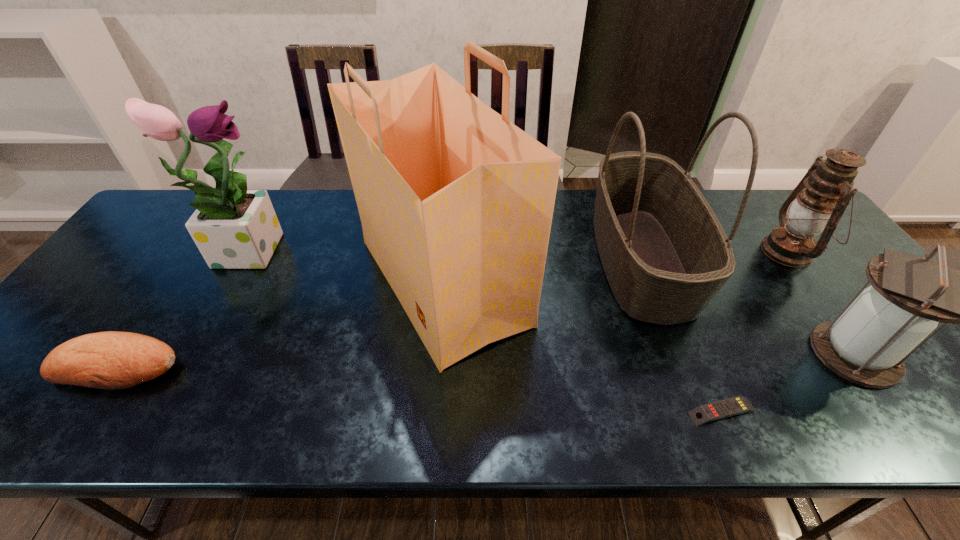
Locate an element on the screen. This screenshot has width=960, height=540. free spot between the lantern and the remote control is located at coordinates (756, 332).

At what (x,y) coordinates should I click in order to perform the action: click on free area in between the flower arrangement and the lantern. Please return your answer as a coordinate pair (x, y). The height and width of the screenshot is (540, 960). Looking at the image, I should click on (551, 301).

I want to click on vacant space that is in between the remote control and the lantern, so click(788, 383).

At what (x,y) coordinates should I click in order to perform the action: click on vacant area between the shortest object and the tallest object. Please return your answer as a coordinate pair (x, y). Image resolution: width=960 pixels, height=540 pixels. Looking at the image, I should click on (583, 347).

Find the location of a particular element. vacant area that lies between the lantern and the basket is located at coordinates (748, 307).

Locate which object is the fourth closest to the flower arrangement. Please provide its 2D coordinates. Your answer should be formatted as a tuple, i.e. [(x, y)], where the tuple contains the x and y coordinates of a point satisfying the conditions above.

[(729, 407)]

Point out which object is positioned as the third nearest to the lantern. Please provide its 2D coordinates. Your answer should be formatted as a tuple, i.e. [(x, y)], where the tuple contains the x and y coordinates of a point satisfying the conditions above.

[(729, 407)]

Find the location of a particular element. The width and height of the screenshot is (960, 540). vacant region that satisfies the following two spatial constraints: 1. on the side of the nearest object with the superhero design; 2. on the left side of the fifth object from right to left is located at coordinates (432, 411).

The height and width of the screenshot is (540, 960). I want to click on vacant space that satisfies the following two spatial constraints: 1. on the front side of the lantern; 2. on the left side of the basket, so click(x=678, y=354).

You are a GUI agent. You are given a task and a screenshot of the screen. Output one action in this format:
    pyautogui.click(x=<x>, y=<y>)
    Task: Click on the vacant space that satisfies the following two spatial constraints: 1. on the back side of the lantern; 2. on the left side of the nearest object
    
    Given the screenshot: What is the action you would take?
    pyautogui.click(x=655, y=252)